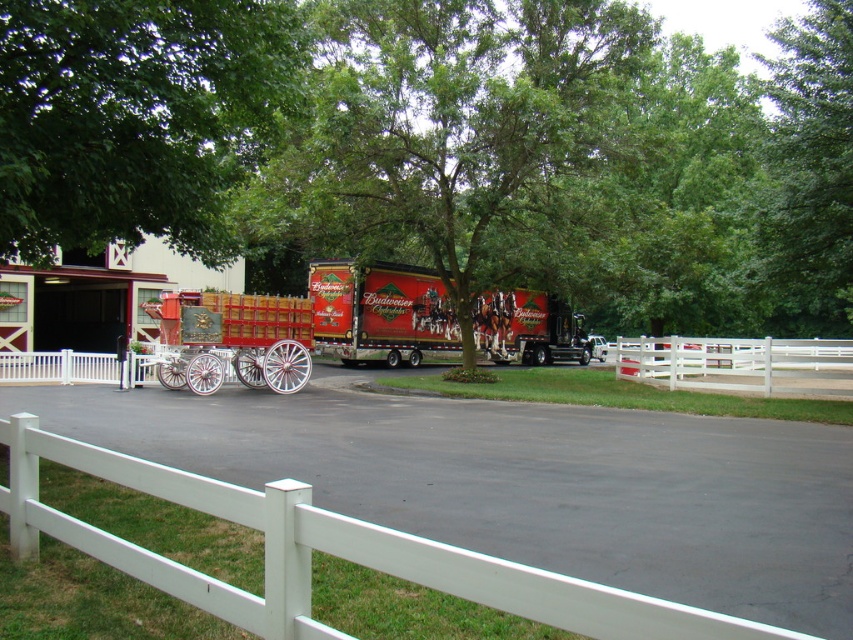
Between point (352, 161) and point (788, 216), which one is positioned in front?

Positioned in front is point (788, 216).

What are the coordinates of `green leafy tree at center` in the screenshot? It's located at (451, 138).

Does green leafy tree at upper left have a smaller size compared to white wooden fence at center?

Yes, green leafy tree at upper left is smaller than white wooden fence at center.

Who is taller, green leafy tree at upper left or white wooden fence at center?

Standing taller between the two is white wooden fence at center.

Between point (183, 141) and point (804, 344), which one is positioned behind?

The point (804, 344) is more distant.

This screenshot has height=640, width=853. In order to click on green leafy tree at upper left in this screenshot , I will do point(137,118).

Who is more forward, [825,109] or [762,340]?

Point [825,109] is in front.

Can you confirm if green leafy tree at upper center is wider than white wooden fence at center?

Yes.

Is point (796, 221) positioned after point (672, 346)?

No, (796, 221) is in front of (672, 346).

The image size is (853, 640). I want to click on green leafy tree at upper center, so click(808, 166).